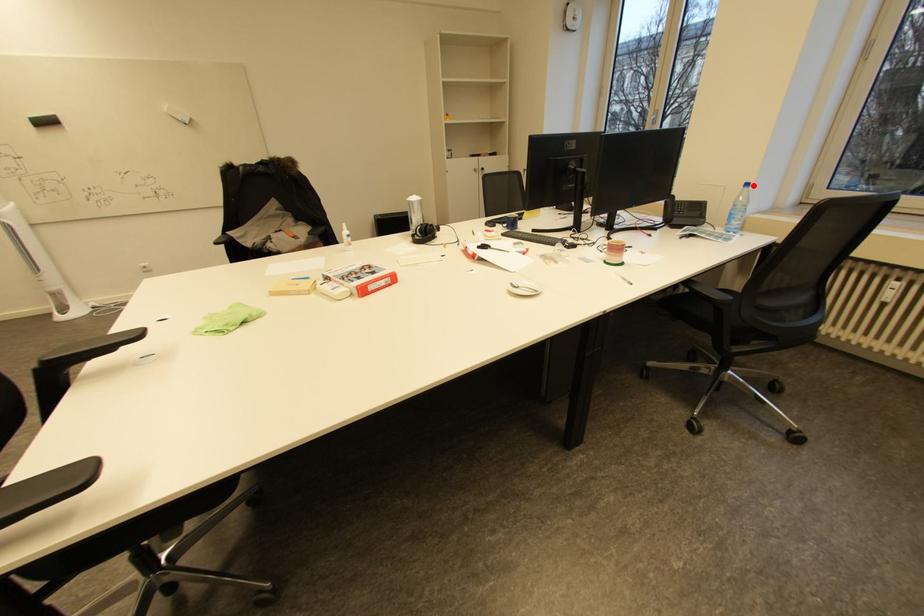
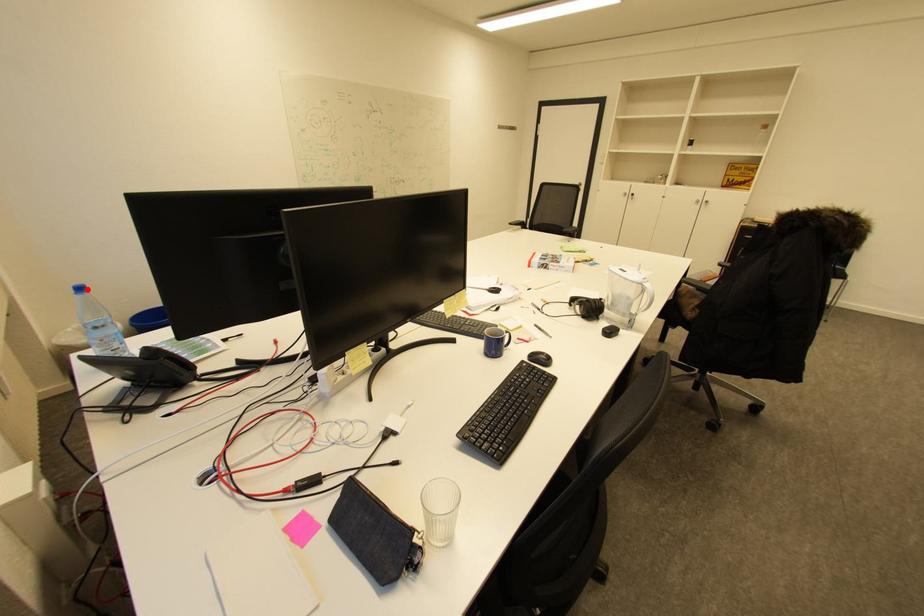
I am providing you with two images of the same scene from different viewpoints. A red point is marked on the first image and another point is marked on the second image. Are the points marked in image1 and image2 representing the same 3D position?

Yes